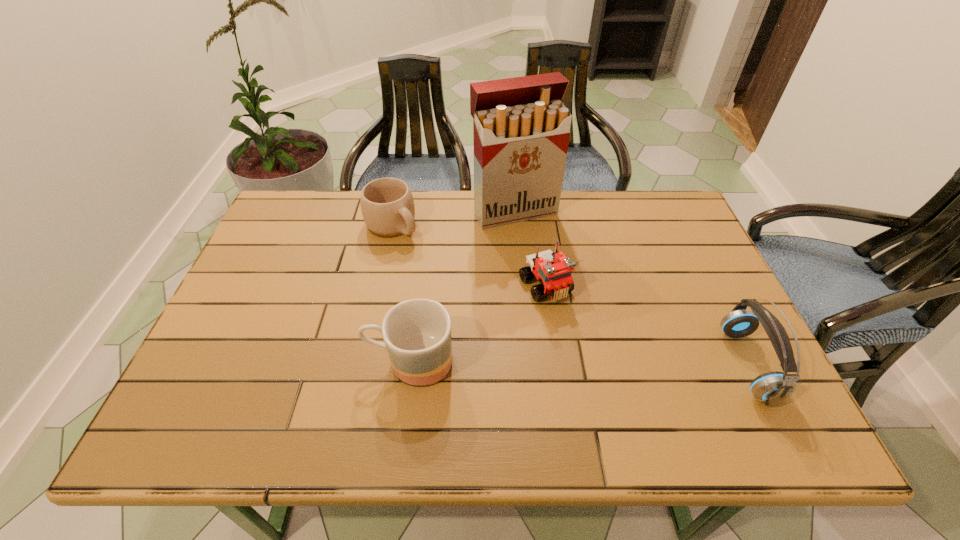
The width and height of the screenshot is (960, 540). In order to click on mug positioned at the far edge in this screenshot , I will do `click(387, 205)`.

At what (x,y) coordinates should I click in order to perform the action: click on cigarette case located at the far edge. Please return your answer as a coordinate pair (x, y). The width and height of the screenshot is (960, 540). Looking at the image, I should click on (521, 129).

In order to click on mug that is at the near edge in this screenshot , I will do `click(417, 333)`.

What are the coordinates of `headset present at the near edge` in the screenshot? It's located at (773, 387).

Identify the location of object located in the right edge section of the desktop. This screenshot has width=960, height=540. (773, 387).

The height and width of the screenshot is (540, 960). I want to click on object situated at the near right corner, so click(773, 387).

Identify the location of free region at the far edge of the desktop. This screenshot has height=540, width=960. (465, 235).

Locate an element on the screen. This screenshot has width=960, height=540. vacant space at the near edge is located at coordinates (303, 369).

The image size is (960, 540). I want to click on vacant area at the left edge, so pyautogui.click(x=260, y=345).

This screenshot has height=540, width=960. In order to click on free space at the far left corner of the desktop in this screenshot , I will do `click(289, 214)`.